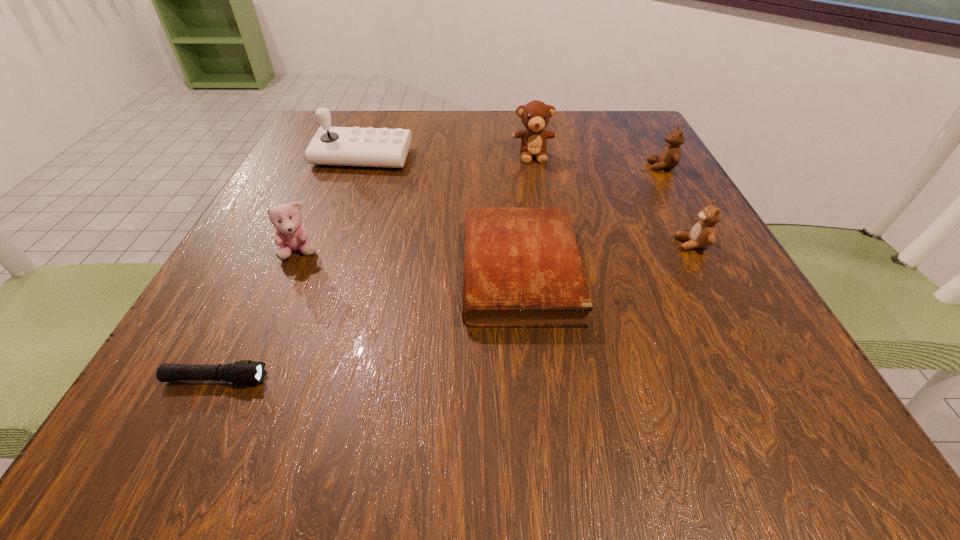
This screenshot has height=540, width=960. I want to click on the third teddy bear from right to left, so click(535, 115).

This screenshot has height=540, width=960. I want to click on joystick, so click(x=335, y=146).

At what (x,y) coordinates should I click in order to perform the action: click on the leftmost teddy bear. Please return your answer as a coordinate pair (x, y). Image resolution: width=960 pixels, height=540 pixels. Looking at the image, I should click on (291, 235).

This screenshot has width=960, height=540. I want to click on Bible, so click(x=522, y=268).

At what (x,y) coordinates should I click in order to perform the action: click on the nearest object. Please return your answer as a coordinate pair (x, y). The height and width of the screenshot is (540, 960). Looking at the image, I should click on (245, 372).

Locate an element on the screen. This screenshot has height=540, width=960. the shortest object is located at coordinates (245, 372).

This screenshot has width=960, height=540. In order to click on vacant space located 0.130m on the face of the third teddy bear from right to left in this screenshot , I will do `click(540, 198)`.

Find the location of `vacant space situated 0.280m on the front of the joystick`. vacant space situated 0.280m on the front of the joystick is located at coordinates (322, 265).

Identify the location of vacant space situated 0.210m at the face of the leftmost teddy bear. The image size is (960, 540). (246, 375).

Find the location of a particular element. free space located on the spine side of the Bible is located at coordinates (382, 271).